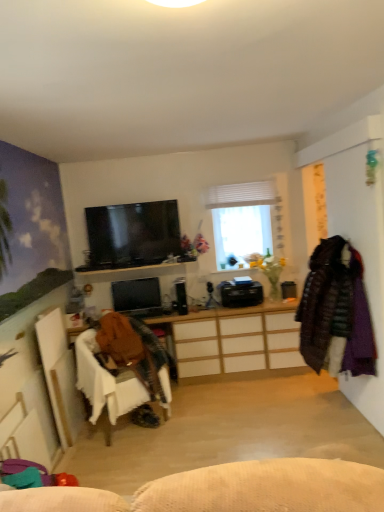
Where is `vacant area on top of white matte window at center (from a real-world perspective)`? vacant area on top of white matte window at center (from a real-world perspective) is located at coordinates (247, 177).